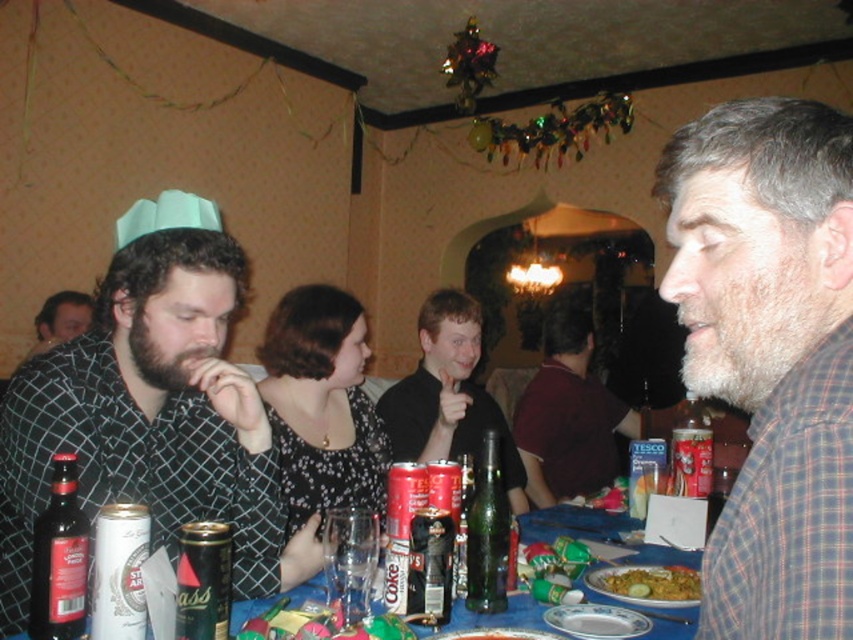
You are a guest at the festive event and want to grab the green glass bottle at center without touching the matte black shirt at left. Is the bottle accessible?

The matte black shirt at left is in front of the green glass bottle at center, so you would need to move the matte black shirt at left to access the green glass bottle at center without touching it.

You are a guest at this festive event and want to place a small ornament on the table between the matte black shirt at left and the green glass bottle at center. Can you fit it there?

The matte black shirt at left is taller than the green glass bottle at center, so there might be enough space between them to place the ornament.